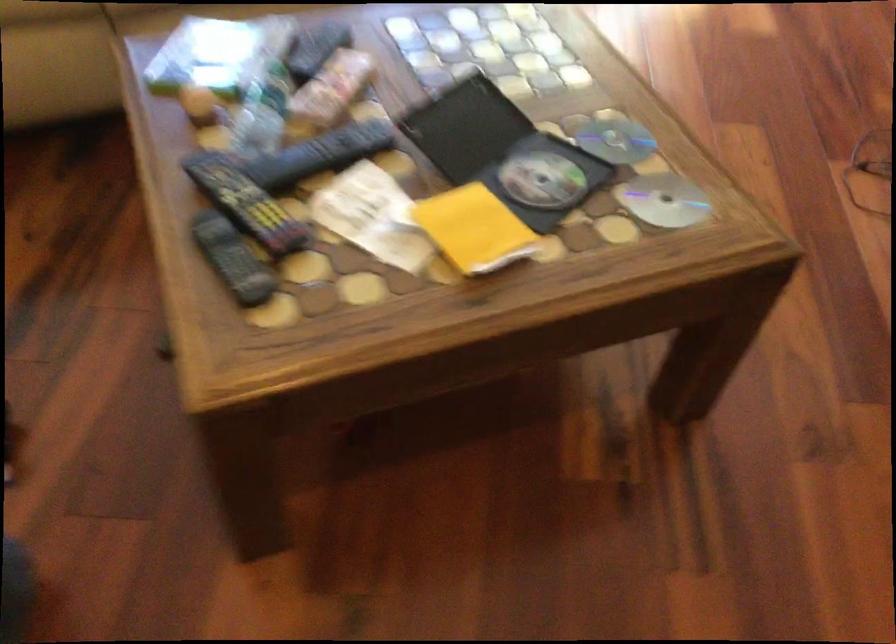
Describe the element at coordinates (503, 152) in the screenshot. The width and height of the screenshot is (896, 644). I see `a black DVD case` at that location.